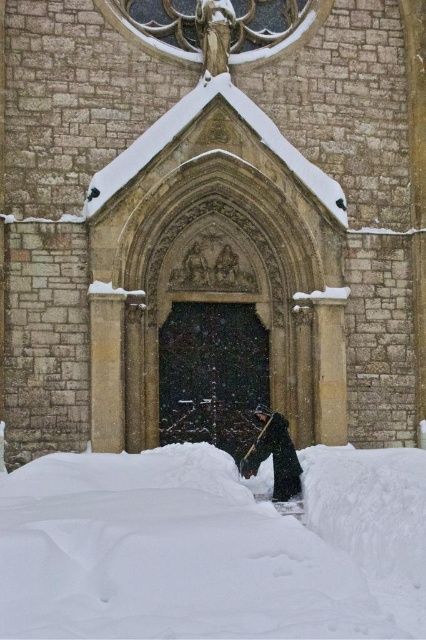
You are standing in a winter scene and want to take a photo of the stone church at center and the white fluffy snow at lower center. To ensure both are in the frame, should you position your camera to the left or right of the snow?

You should position your camera to the left of the white fluffy snow at lower center because the stone church at center is to the right of the white fluffy snow at lower center, so placing the camera to the left will keep both in the frame.